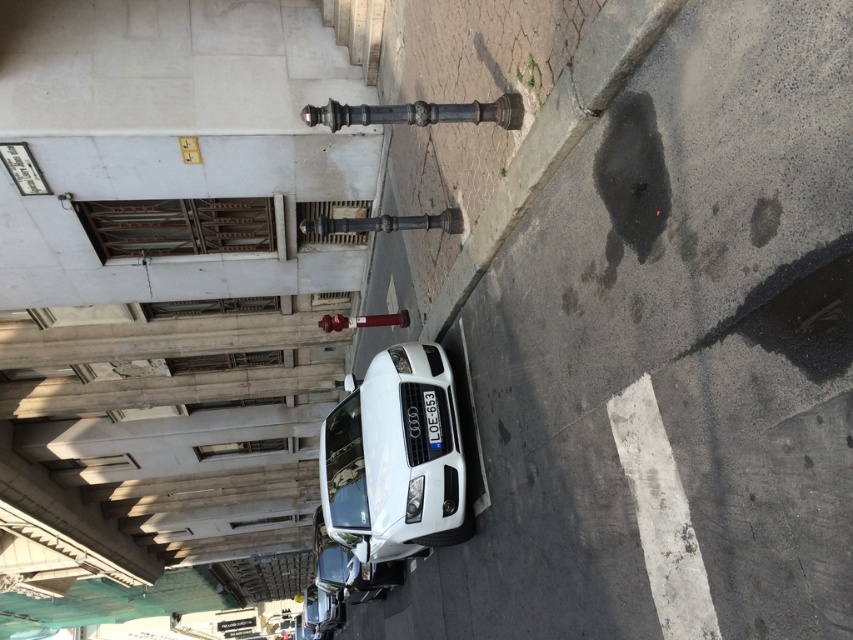
You are a delivery person who needs to park your van next to the white glossy car at center and the black plastic license plate at center. Since your van is 2 meters tall, will there be enough vertical clearance under the nearby bridge that is 2.5 meters high?

The white glossy car at center is taller than the black plastic license plate at center. Since the bridge is 2.5 meters high and the van is 2 meters tall, the van can pass under the bridge as its height is less than the bridge clearance.

You are standing at the point with coordinates 0.6, 0.5. You want to walk to the white glossy car at center. In which direction should you move?

Since the car is at (393, 460) and you are at (426, 384), you should move northeast to reach the car.